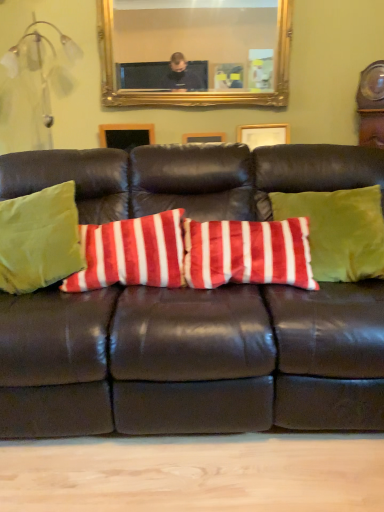
Question: Is velvety red and white striped pillow at center, the second pillow in the right-to-left sequence, oriented towards velvet green pillow at center, placed as the first pillow when sorted from right to left?

Choices:
 (A) yes
 (B) no

Answer: (B)

Question: From a real-world perspective, is velvety red and white striped pillow at center, the second pillow in the right-to-left sequence, below velvet green pillow at center, which is counted as the 3th pillow, starting from the left?

Choices:
 (A) yes
 (B) no

Answer: (A)

Question: From the image's perspective, is velvety red and white striped pillow at center, which is the 2th pillow from left to right, located above velvet green pillow at center, which is counted as the 3th pillow, starting from the left?

Choices:
 (A) yes
 (B) no

Answer: (B)

Question: Does velvety red and white striped pillow at center, the second pillow in the right-to-left sequence, have a lesser width compared to velvet green pillow at center, placed as the first pillow when sorted from right to left?

Choices:
 (A) yes
 (B) no

Answer: (B)

Question: From a real-world perspective, is velvety red and white striped pillow at center, which is the 2th pillow from left to right, over velvet green pillow at center, placed as the first pillow when sorted from right to left?

Choices:
 (A) no
 (B) yes

Answer: (A)

Question: From a real-world perspective, is velvety red and white striped pillow at center, which is the 2th pillow from left to right, positioned above or below green velvet pillow at left, the 1th pillow in the left-to-right sequence?

Choices:
 (A) below
 (B) above

Answer: (A)

Question: Is velvety red and white striped pillow at center, the second pillow in the right-to-left sequence, wider or thinner than green velvet pillow at left, the 1th pillow in the left-to-right sequence?

Choices:
 (A) thin
 (B) wide

Answer: (A)

Question: Do you think velvety red and white striped pillow at center, which is the 2th pillow from left to right, is within green velvet pillow at left, the 1th pillow in the left-to-right sequence, or outside of it?

Choices:
 (A) inside
 (B) outside

Answer: (B)

Question: Is velvety red and white striped pillow at center, which is the 2th pillow from left to right, taller or shorter than green velvet pillow at left, the 1th pillow in the left-to-right sequence?

Choices:
 (A) short
 (B) tall

Answer: (A)

Question: Looking at their shapes, would you say velvety red and white striped pillow at center, which is the 2th pillow from left to right, is wider or thinner than gold-framed mirror at upper center?

Choices:
 (A) wide
 (B) thin

Answer: (A)

Question: From their relative heights in the image, would you say velvety red and white striped pillow at center, the second pillow in the right-to-left sequence, is taller or shorter than gold-framed mirror at upper center?

Choices:
 (A) short
 (B) tall

Answer: (A)

Question: In the image, is velvety red and white striped pillow at center, the second pillow in the right-to-left sequence, on the left side or the right side of gold-framed mirror at upper center?

Choices:
 (A) left
 (B) right

Answer: (A)

Question: From the image's perspective, is velvety red and white striped pillow at center, the second pillow in the right-to-left sequence, positioned above or below gold-framed mirror at upper center?

Choices:
 (A) below
 (B) above

Answer: (A)

Question: From the image's perspective, relative to velvet green pillow at center, placed as the first pillow when sorted from right to left, is velvety red and white striped pillow at center, the second pillow in the right-to-left sequence, above or below?

Choices:
 (A) above
 (B) below

Answer: (B)

Question: Is velvety red and white striped pillow at center, which is the 2th pillow from left to right, taller or shorter than velvet green pillow at center, placed as the first pillow when sorted from right to left?

Choices:
 (A) short
 (B) tall

Answer: (A)